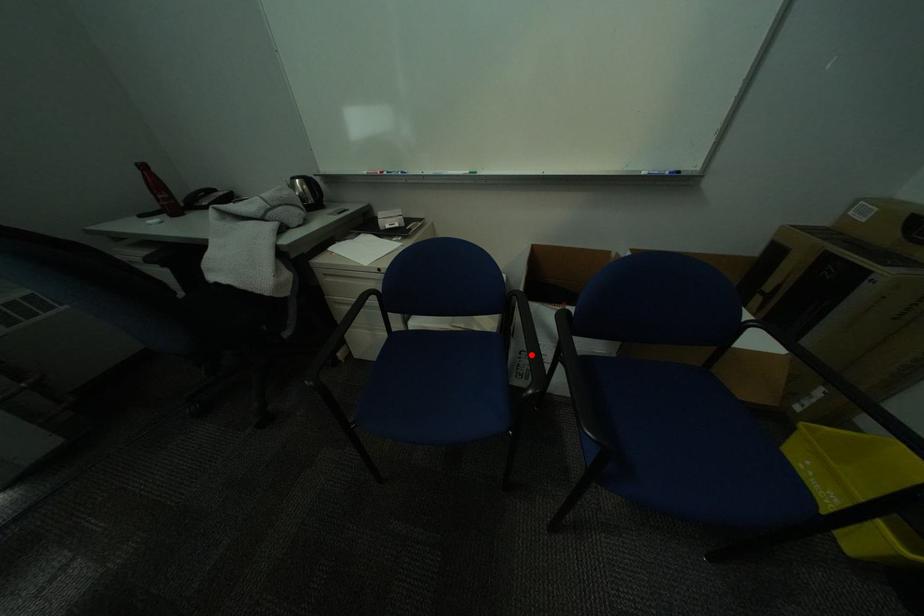
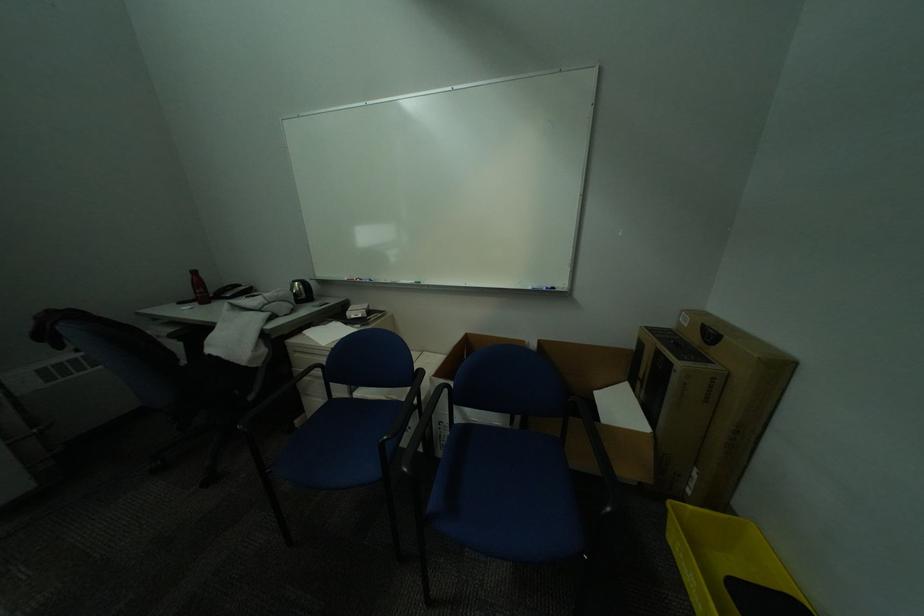
Question: I am providing you with two images of the same scene from different viewpoints. Given a red point in image1, look at the same physical point in image2. Is it:

Choices:
 (A) Closer to the viewpoint
 (B) Farther from the viewpoint

Answer: (B)